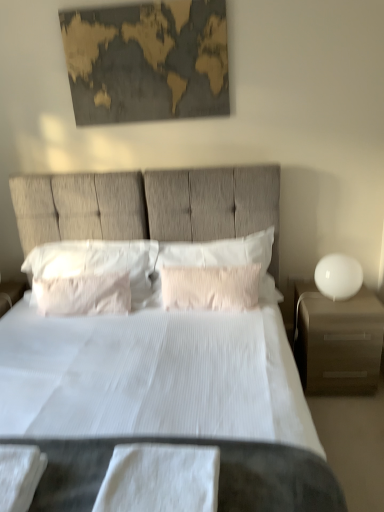
Question: Is white textured bed at center turned away from white textured pillow at center, acting as the 2th pillow starting from the right?

Choices:
 (A) yes
 (B) no

Answer: (A)

Question: From the image's perspective, is white textured bed at center above white textured pillow at center, which is the third pillow in left-to-right order?

Choices:
 (A) yes
 (B) no

Answer: (B)

Question: Is the surface of white textured bed at center in direct contact with white textured pillow at center, which is the third pillow in left-to-right order?

Choices:
 (A) no
 (B) yes

Answer: (A)

Question: From a real-world perspective, is white textured bed at center positioned under white textured pillow at center, acting as the 2th pillow starting from the right, based on gravity?

Choices:
 (A) no
 (B) yes

Answer: (A)

Question: Can you confirm if white textured bed at center is positioned to the left of white textured pillow at center, acting as the 2th pillow starting from the right?

Choices:
 (A) yes
 (B) no

Answer: (A)

Question: Is white textured bed at center to the right of white textured pillow at center, acting as the 2th pillow starting from the right, from the viewer's perspective?

Choices:
 (A) no
 (B) yes

Answer: (A)

Question: Is white textured pillow at center, which is the third pillow in left-to-right order, taller than gold textured map at upper center?

Choices:
 (A) yes
 (B) no

Answer: (B)

Question: Can you confirm if white textured pillow at center, which is the third pillow in left-to-right order, is bigger than gold textured map at upper center?

Choices:
 (A) no
 (B) yes

Answer: (B)

Question: Is white textured pillow at center, acting as the 2th pillow starting from the right, to the right of gold textured map at upper center from the viewer's perspective?

Choices:
 (A) yes
 (B) no

Answer: (A)

Question: Is white textured pillow at center, acting as the 2th pillow starting from the right, thinner than gold textured map at upper center?

Choices:
 (A) yes
 (B) no

Answer: (B)

Question: From a real-world perspective, is white textured pillow at center, acting as the 2th pillow starting from the right, over gold textured map at upper center?

Choices:
 (A) no
 (B) yes

Answer: (A)

Question: Does white textured pillow at center, which is the third pillow in left-to-right order, have a smaller size compared to gold textured map at upper center?

Choices:
 (A) yes
 (B) no

Answer: (B)

Question: Can you confirm if white glossy sphere at right is wider than matte brown nightstand at right?

Choices:
 (A) no
 (B) yes

Answer: (A)